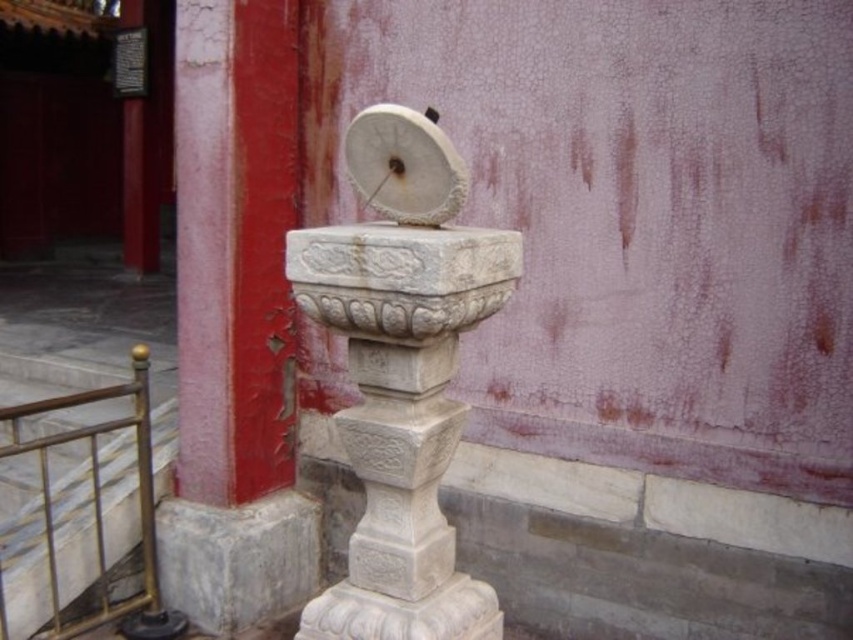
Measure the distance from white stone sundial at center to brushed metal railing at lower left.

A distance of 1.23 meters exists between white stone sundial at center and brushed metal railing at lower left.

Is white stone sundial at center in front of brushed metal railing at lower left?

Yes.

Who is more distant from viewer, [451,205] or [47,477]?

Point [47,477]

The width and height of the screenshot is (853, 640). Identify the location of white stone sundial at center. (402, 372).